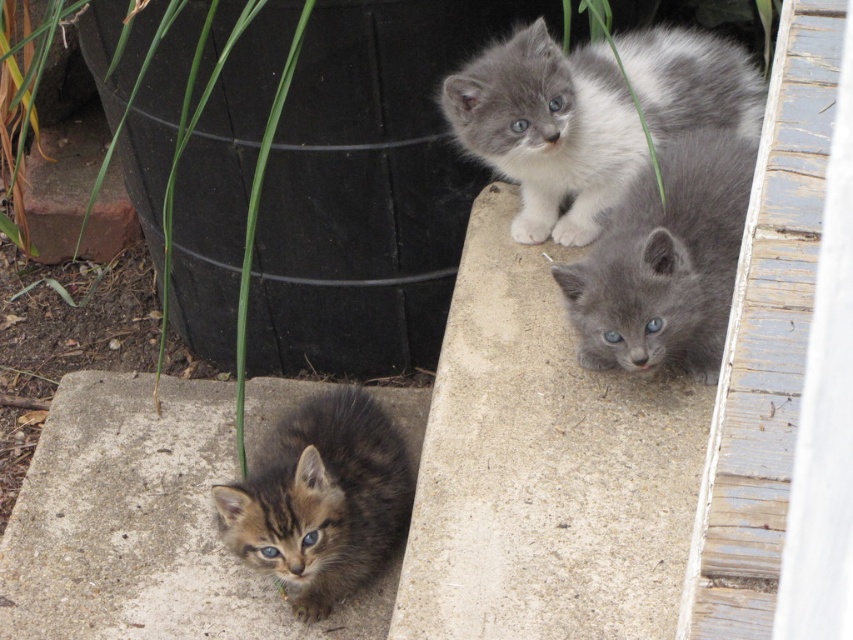
Consider the image. You are standing at the center of the image and want to walk to the gray concrete at upper center located at point [543,467]. What direction should you head towards?

You should head towards the upper center direction to reach the gray concrete at upper center located at point [543,467].

Based on the photo, you are a photographer trying to capture both the gray fluffy kitten at upper center and the gray fluffy kitten at upper right in a single shot. Since you want both kittens to be fully visible in the photo, which kitten might block the view of the other? Please explain based on their positions.

The gray fluffy kitten at upper right is behind the gray fluffy kitten at upper center, so the gray fluffy kitten at upper center might block the view of the gray fluffy kitten at upper right if they are positioned in a straight line from the camera. To ensure both are fully visible, adjust the angle so neither is obscured.

You are standing at the point marked as point (218,420) in the image. You want to throw a small ball to a friend who is standing 3 meters away from you. Is your friend within reach?

The distance between you and the viewer is 2.93 meters, so yes, your friend is within reach since the distance is slightly less than 3 meters.